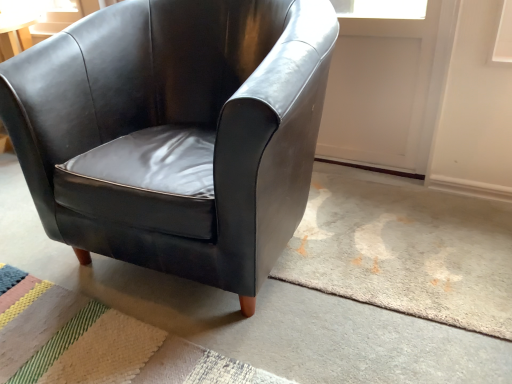
Question: Can you confirm if textured beige rug at lower left is shorter than matte black armchair at center?

Choices:
 (A) yes
 (B) no

Answer: (A)

Question: From the image's perspective, would you say textured beige rug at lower left is shown under matte black armchair at center?

Choices:
 (A) no
 (B) yes

Answer: (B)

Question: Could you tell me if textured beige rug at lower left is facing matte black armchair at center?

Choices:
 (A) yes
 (B) no

Answer: (B)

Question: Considering the relative sizes of textured beige rug at lower left and matte black armchair at center in the image provided, is textured beige rug at lower left bigger than matte black armchair at center?

Choices:
 (A) no
 (B) yes

Answer: (A)

Question: From a real-world perspective, is textured beige rug at lower left positioned under matte black armchair at center based on gravity?

Choices:
 (A) no
 (B) yes

Answer: (B)

Question: In the image, is matte black armchair at center positioned in front of or behind textured beige rug at lower left?

Choices:
 (A) front
 (B) behind

Answer: (A)

Question: Considering the positions of point (24, 231) and point (101, 345), is point (24, 231) closer or farther from the camera than point (101, 345)?

Choices:
 (A) closer
 (B) farther

Answer: (B)

Question: From the image's perspective, is matte black armchair at center located above or below textured beige rug at lower left?

Choices:
 (A) above
 (B) below

Answer: (A)

Question: Is matte black armchair at center bigger or smaller than textured beige rug at lower left?

Choices:
 (A) small
 (B) big

Answer: (B)

Question: From a real-world perspective, is matte black armchair at center physically located above or below textured beige rug at lower left?

Choices:
 (A) below
 (B) above

Answer: (B)

Question: Visually, is matte black armchair at center positioned to the left or to the right of textured beige rug at lower left?

Choices:
 (A) right
 (B) left

Answer: (A)

Question: From the image's perspective, is matte black armchair at center positioned above or below textured beige rug at lower left?

Choices:
 (A) below
 (B) above

Answer: (B)

Question: Is matte black armchair at center taller or shorter than textured beige rug at lower left?

Choices:
 (A) short
 (B) tall

Answer: (B)

Question: From a real-world perspective, relative to matte black armchair at center, is matte black armchair at center vertically above or below?

Choices:
 (A) below
 (B) above

Answer: (B)

Question: Is matte black armchair at center wider or thinner than matte black armchair at center?

Choices:
 (A) thin
 (B) wide

Answer: (A)